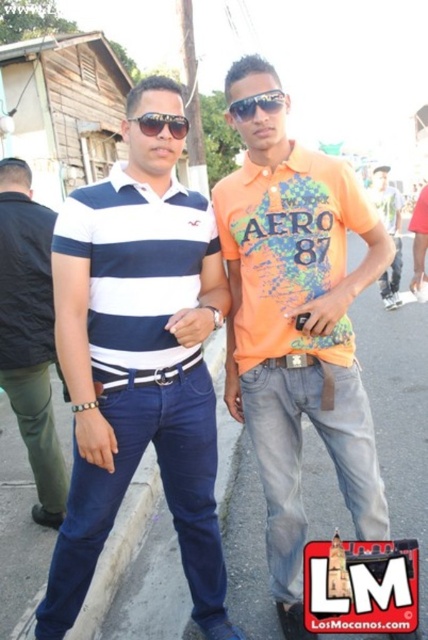
Question: Among these objects, which one is nearest to the camera?

Choices:
 (A) matte striped polo shirt at left
 (B) sunglasses at center

Answer: (A)

Question: Can you confirm if blue and white striped polo shirt at left is bigger than sunglasses at center?

Choices:
 (A) yes
 (B) no

Answer: (A)

Question: Estimate the real-world distances between objects in this image. Which object is farther from the orange printed t-shirt at right?

Choices:
 (A) matte black shirt at left
 (B) blue and white striped polo shirt at left

Answer: (A)

Question: Does orange printed t-shirt at center come in front of sunglasses at center?

Choices:
 (A) yes
 (B) no

Answer: (B)

Question: Considering the real-world distances, which object is farthest from the orange printed t-shirt at right?

Choices:
 (A) sunglasses at center
 (B) matte black sunglasses at center
 (C) matte striped polo shirt at left
 (D) matte black shirt at left

Answer: (D)

Question: Can you confirm if matte striped polo shirt at left is thinner than sunglasses at center?

Choices:
 (A) no
 (B) yes

Answer: (A)